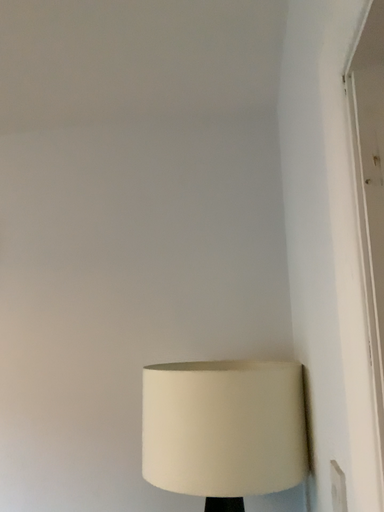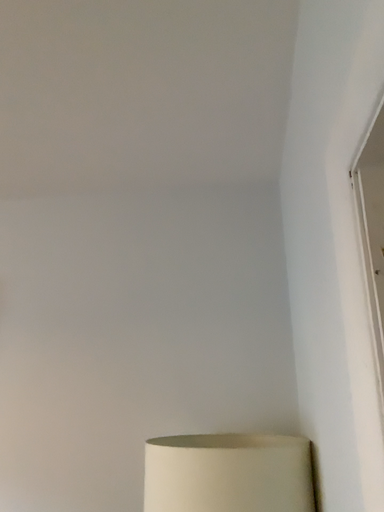
Question: How did the camera likely rotate when shooting the video?

Choices:
 (A) rotated downward
 (B) rotated upward

Answer: (B)